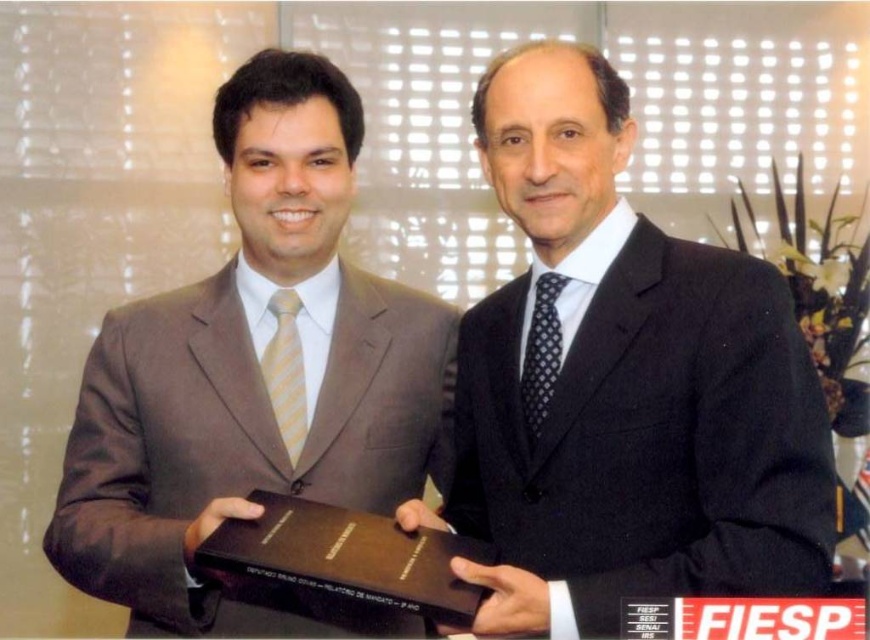
Question: Among these points, which one is nearest to the camera?

Choices:
 (A) pos(774,513)
 (B) pos(402,547)
 (C) pos(350,497)

Answer: (A)

Question: Which of the following is the farthest from the observer?

Choices:
 (A) black matte suit at center
 (B) brown leather book at center
 (C) brown suit at left

Answer: (C)

Question: Is black matte suit at center in front of brown leather book at center?

Choices:
 (A) yes
 (B) no

Answer: (B)

Question: Which is farther from the brown leather book at center?

Choices:
 (A) black matte suit at center
 (B) brown suit at left

Answer: (A)

Question: Is brown suit at left thinner than brown leather book at center?

Choices:
 (A) yes
 (B) no

Answer: (B)

Question: Does black matte suit at center appear on the right side of brown leather book at center?

Choices:
 (A) yes
 (B) no

Answer: (A)